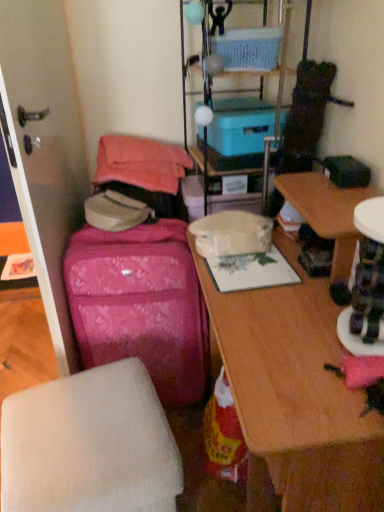
Describe the element at coordinates (44, 148) in the screenshot. I see `transparent plastic screen door at left` at that location.

Where is `blue cardboard box at upper center, marked as the 1th storage box in a top-to-bottom arrangement`? blue cardboard box at upper center, marked as the 1th storage box in a top-to-bottom arrangement is located at coordinates (248, 48).

You are a GUI agent. You are given a task and a screenshot of the screen. Output one action in this format:
    pyautogui.click(x=<x>, y=<y>)
    Task: Click on the white matte ottoman at lower left
    The width and height of the screenshot is (384, 512).
    Given the screenshot: What is the action you would take?
    [89, 445]

Looking at this image, is blue plastic storage box at center, which is counted as the second storage box, starting from the top, not near blue cardboard box at upper center, marked as the 1th storage box in a top-to-bottom arrangement?

No, blue plastic storage box at center, which is counted as the second storage box, starting from the top, is not far from blue cardboard box at upper center, marked as the 1th storage box in a top-to-bottom arrangement.

Considering the positions of point (244, 154) and point (229, 35), is point (244, 154) closer or farther from the camera than point (229, 35)?

Point (244, 154).

Which object is closer to the camera, blue plastic storage box at center, which is counted as the second storage box, starting from the top, or blue cardboard box at upper center, marked as the 1th storage box in a top-to-bottom arrangement?

blue cardboard box at upper center, marked as the 1th storage box in a top-to-bottom arrangement, is in front.

Is blue plastic storage box at center, which ranks as the 1th storage box in bottom-to-top order, taller or shorter than blue cardboard box at upper center, marked as the 1th storage box in a top-to-bottom arrangement?

In the image, blue plastic storage box at center, which ranks as the 1th storage box in bottom-to-top order, appears to be taller than blue cardboard box at upper center, marked as the 1th storage box in a top-to-bottom arrangement.

Is white matte ottoman at lower left bigger or smaller than blue plastic storage box at center, which is counted as the second storage box, starting from the top?

white matte ottoman at lower left is bigger than blue plastic storage box at center, which is counted as the second storage box, starting from the top.

Is white matte ottoman at lower left not near blue plastic storage box at center, which ranks as the 1th storage box in bottom-to-top order?

Actually, white matte ottoman at lower left and blue plastic storage box at center, which ranks as the 1th storage box in bottom-to-top order, are a little close together.

Is blue plastic storage box at center, which is counted as the second storage box, starting from the top, a part of white matte ottoman at lower left?

Definitely not — blue plastic storage box at center, which is counted as the second storage box, starting from the top, is not inside white matte ottoman at lower left.

Considering the sizes of objects blue cardboard box at upper center, arranged as the second storage box when ordered from the bottom, and transparent plastic screen door at left in the image provided, who is smaller, blue cardboard box at upper center, arranged as the second storage box when ordered from the bottom, or transparent plastic screen door at left?

With smaller size is blue cardboard box at upper center, arranged as the second storage box when ordered from the bottom.

There is a transparent plastic screen door at left. Where is `the 2nd storage box above it (from a real-world perspective)`? This screenshot has height=512, width=384. the 2nd storage box above it (from a real-world perspective) is located at coordinates (248, 48).

In the scene shown: From a real-world perspective, is blue cardboard box at upper center, marked as the 1th storage box in a top-to-bottom arrangement, positioned above or below transparent plastic screen door at left?

Clearly, from a real-world perspective, blue cardboard box at upper center, marked as the 1th storage box in a top-to-bottom arrangement, is above transparent plastic screen door at left.

Which is closer to the camera, (205, 99) or (48, 121)?

Clearly, point (205, 99) is more distant from the camera than point (48, 121).

Image resolution: width=384 pixels, height=512 pixels. Find the location of `shelf on the right of transparent plastic screen door at left`. shelf on the right of transparent plastic screen door at left is located at coordinates point(282,62).

Which object is more forward, blue plastic storage at upper center or transparent plastic screen door at left?

transparent plastic screen door at left is closer to the camera.

Considering the sizes of objects blue plastic storage at upper center and transparent plastic screen door at left in the image provided, who is thinner, blue plastic storage at upper center or transparent plastic screen door at left?

transparent plastic screen door at left.

Considering the relative sizes of blue plastic storage box at center, which ranks as the 1th storage box in bottom-to-top order, and wooden desk at center in the image provided, is blue plastic storage box at center, which ranks as the 1th storage box in bottom-to-top order, wider than wooden desk at center?

Incorrect, the width of blue plastic storage box at center, which ranks as the 1th storage box in bottom-to-top order, does not surpass that of wooden desk at center.

Is blue plastic storage box at center, which is counted as the second storage box, starting from the top, positioned beyond the bounds of wooden desk at center?

Yes.

Is point (274, 120) closer or farther from the camera than point (367, 423)?

Point (274, 120) is farther from the camera than point (367, 423).

From the picture: Which object is closer to the camera, blue plastic storage box at center, which is counted as the second storage box, starting from the top, or wooden desk at center?

Positioned in front is wooden desk at center.

Would you say blue plastic storage box at center, which ranks as the 1th storage box in bottom-to-top order, is to the left or to the right of transparent plastic screen door at left in the picture?

From the image, it's evident that blue plastic storage box at center, which ranks as the 1th storage box in bottom-to-top order, is to the right of transparent plastic screen door at left.

At what (x,y) coordinates should I click in order to perform the action: click on screen door below the blue plastic storage box at center, which ranks as the 1th storage box in bottom-to-top order (from a real-world perspective). Please return your answer as a coordinate pair (x, y). Image resolution: width=384 pixels, height=512 pixels. Looking at the image, I should click on (44, 148).

Measure the distance between blue plastic storage box at center, which is counted as the second storage box, starting from the top, and transparent plastic screen door at left.

blue plastic storage box at center, which is counted as the second storage box, starting from the top, and transparent plastic screen door at left are 25.55 inches apart.

Is point (252, 126) positioned after point (64, 36)?

That is False.

Is blue cardboard box at upper center, marked as the 1th storage box in a top-to-bottom arrangement, not near blue plastic storage at upper center?

No, there isn't a large distance between blue cardboard box at upper center, marked as the 1th storage box in a top-to-bottom arrangement, and blue plastic storage at upper center.

Is blue cardboard box at upper center, marked as the 1th storage box in a top-to-bottom arrangement, thinner than blue plastic storage at upper center?

Yes.

How different are the orientations of blue cardboard box at upper center, marked as the 1th storage box in a top-to-bottom arrangement, and blue plastic storage at upper center in degrees?

4 degrees.

From the image's perspective, is blue cardboard box at upper center, arranged as the second storage box when ordered from the bottom, located beneath blue plastic storage at upper center?

Incorrect, from the image's perspective, blue cardboard box at upper center, arranged as the second storage box when ordered from the bottom, is higher than blue plastic storage at upper center.

I want to click on storage box below the blue cardboard box at upper center, marked as the 1th storage box in a top-to-bottom arrangement (from a real-world perspective), so [240, 126].

Locate an element on the screen. This screenshot has width=384, height=512. storage box that is the 1st one when counting upward from the white matte ottoman at lower left (from the image's perspective) is located at coordinates (240, 126).

Considering their positions, is wooden desk at center positioned closer to blue plastic storage at upper center than transparent plastic screen door at left?

The object closer to blue plastic storage at upper center is transparent plastic screen door at left.

From the image, which object appears to be nearer to wooden desk at center, pink fabric suitcase at left or transparent plastic screen door at left?

pink fabric suitcase at left.

From the picture: From the image, which object appears to be nearer to blue cardboard box at upper center, marked as the 1th storage box in a top-to-bottom arrangement, wooden desk at center or blue plastic storage box at center, which ranks as the 1th storage box in bottom-to-top order?

blue plastic storage box at center, which ranks as the 1th storage box in bottom-to-top order, is positioned closer to the anchor blue cardboard box at upper center, marked as the 1th storage box in a top-to-bottom arrangement.

When comparing their distances from blue plastic storage at upper center, does wooden desk at center or blue plastic storage box at center, which is counted as the second storage box, starting from the top, seem closer?

blue plastic storage box at center, which is counted as the second storage box, starting from the top, lies closer to blue plastic storage at upper center than the other object.

Which object lies nearer to the anchor point blue cardboard box at upper center, arranged as the second storage box when ordered from the bottom, blue plastic storage at upper center or white matte ottoman at lower left?

blue plastic storage at upper center is positioned closer to the anchor blue cardboard box at upper center, arranged as the second storage box when ordered from the bottom.

Looking at the image, which one is located further to blue plastic storage at upper center, wooden desk at center or pink fabric suitcase at left?

Based on the image, wooden desk at center appears to be further to blue plastic storage at upper center.

Estimate the real-world distances between objects in this image. Which object is closer to pink fabric suitcase at left, blue plastic storage box at center, which ranks as the 1th storage box in bottom-to-top order, or blue cardboard box at upper center, marked as the 1th storage box in a top-to-bottom arrangement?

Based on the image, blue plastic storage box at center, which ranks as the 1th storage box in bottom-to-top order, appears to be nearer to pink fabric suitcase at left.

When comparing their distances from transparent plastic screen door at left, does wooden desk at center or pink fabric suitcase at left seem further?

wooden desk at center.

Find the location of a particular element. The image size is (384, 512). furniture between wooden desk at center and pink fabric suitcase at left in the front-back direction is located at coordinates (89, 445).

I want to click on screen door between blue plastic storage at upper center and white matte ottoman at lower left in the vertical direction, so click(44, 148).

Where is `shelf between transparent plastic screen door at left and wooden desk at center in the horizontal direction`? shelf between transparent plastic screen door at left and wooden desk at center in the horizontal direction is located at coordinates (282, 62).

Identify the location of screen door between blue plastic storage box at center, which ranks as the 1th storage box in bottom-to-top order, and wooden desk at center in the up-down direction. (44, 148).